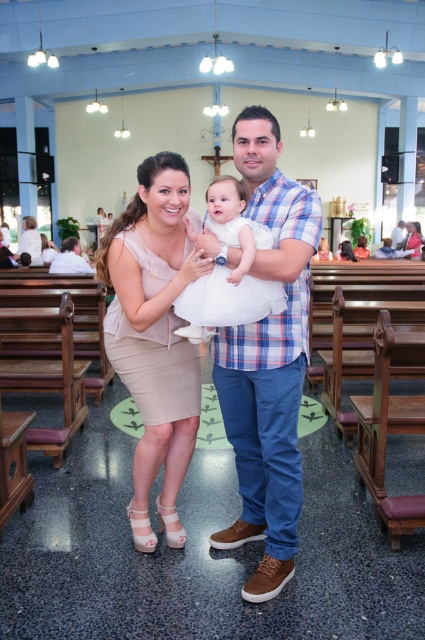
Question: Which of the following is the closest to the observer?

Choices:
 (A) white tulle dress at center
 (B) blue plaid shirt at center
 (C) beige satin dress at center

Answer: (B)

Question: Is blue plaid shirt at center closer to camera compared to white tulle dress at center?

Choices:
 (A) yes
 (B) no

Answer: (A)

Question: Which point is farther from the camera taking this photo?

Choices:
 (A) coord(244,236)
 (B) coord(278,348)
 (C) coord(158,176)

Answer: (B)

Question: Is beige satin dress at center above white tulle dress at center?

Choices:
 (A) no
 (B) yes

Answer: (A)

Question: Which of the following is the farthest from the observer?

Choices:
 (A) beige satin dress at center
 (B) blue plaid shirt at center

Answer: (A)

Question: Is blue plaid shirt at center to the right of beige satin dress at center from the viewer's perspective?

Choices:
 (A) no
 (B) yes

Answer: (B)